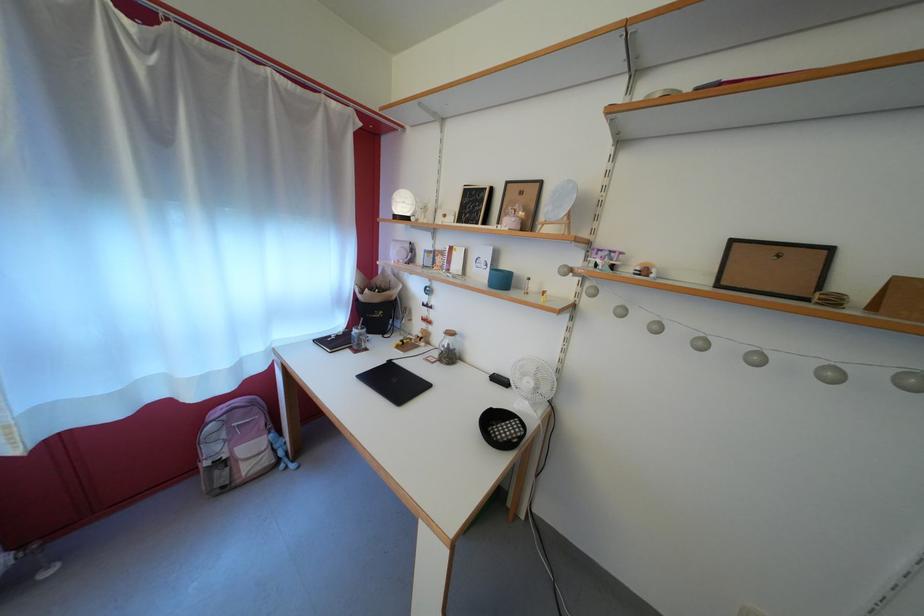
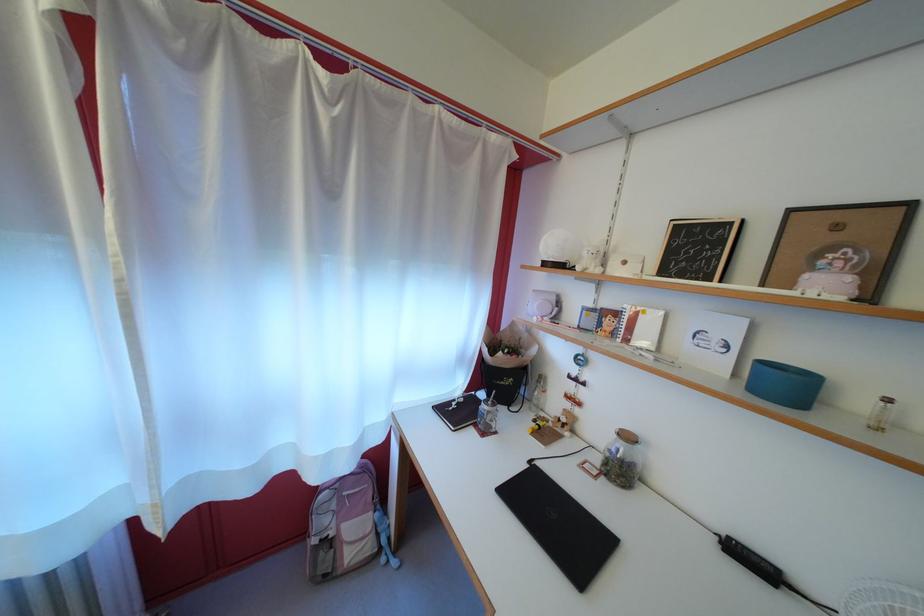
Which direction would the cameraman need to move to produce the second image?

The movement direction of the cameraman is left, forward.